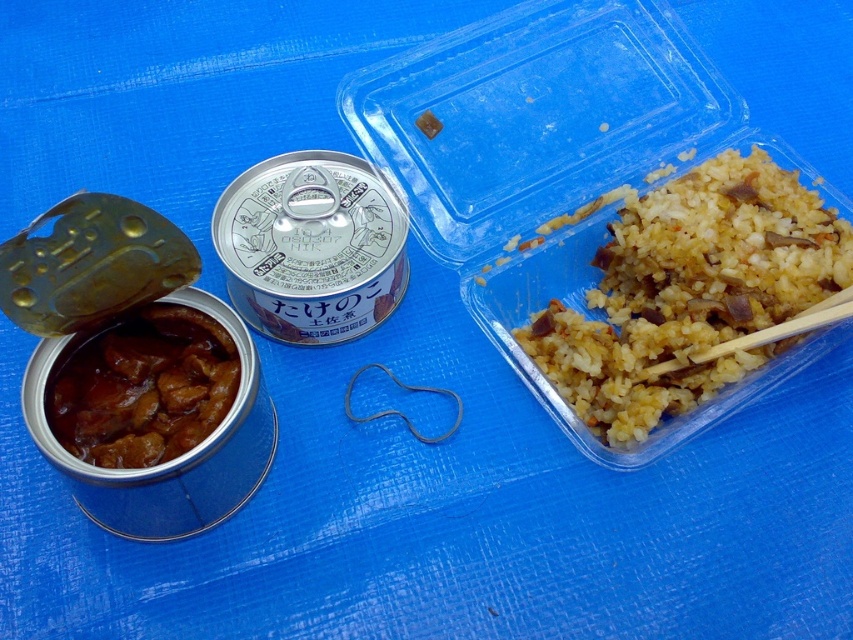
Question: Among these objects, which one is farthest from the camera?

Choices:
 (A) brown rice at right
 (B) brown glossy meat at center

Answer: (A)

Question: Which point is farther to the camera?

Choices:
 (A) 225,340
 (B) 809,198

Answer: (B)

Question: Is brown rice at right to the right of brown glossy meat at center from the viewer's perspective?

Choices:
 (A) yes
 (B) no

Answer: (A)

Question: Does brown rice at right appear on the left side of brown glossy meat at center?

Choices:
 (A) no
 (B) yes

Answer: (A)

Question: Considering the relative positions of brown rice at right and brown glossy meat at center in the image provided, where is brown rice at right located with respect to brown glossy meat at center?

Choices:
 (A) below
 (B) above

Answer: (B)